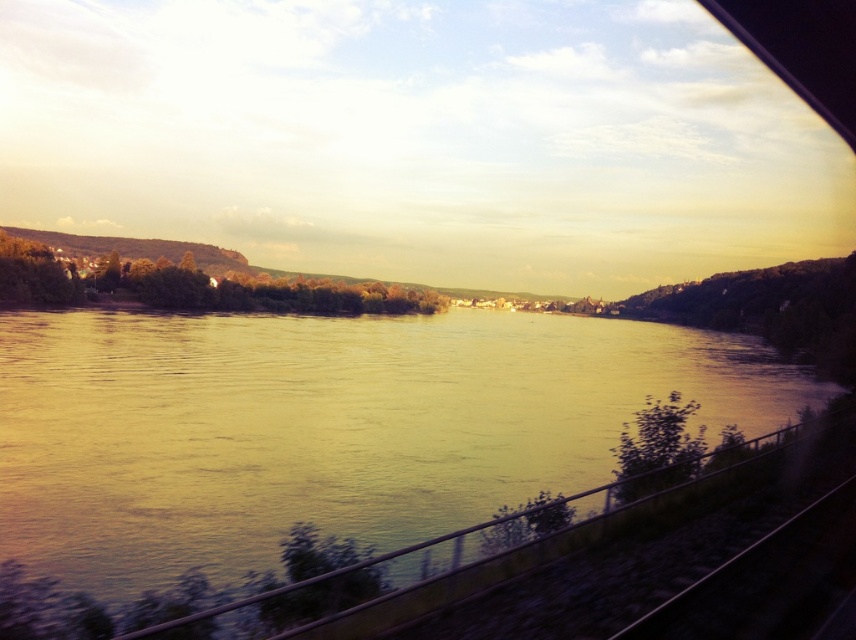
You are a photographer standing on the train platform and want to capture a photo of the yellowish water at center and the black metal train track at lower right. Which object will appear wider in the photo?

The yellowish water at center will appear wider in the photo because its width surpasses that of the black metal train track at lower right.

You are a photographer trying to capture the golden hour reflection on the yellowish water at center while also including the black metal train track at lower right in the frame. Given their sizes, will you need to adjust your camera angle to ensure both are visible?

The yellowish water at center is larger in size than the black metal train track at lower right, so you will need to adjust your camera angle to ensure both are visible in the frame.

Consider the image. You are a passenger on a train and looking out the window at the riverside scene. There are two points marked on the window at coordinates point [16,374] and point [755,541]. Which point is closer to you?

Point [16,374] is closer to you than point [755,541] because it is further to the viewer according to the description.